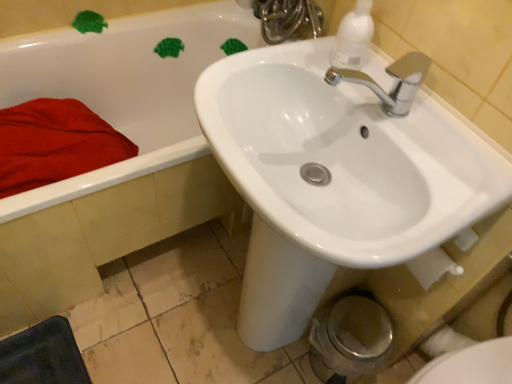
Question: Is white glossy sink at upper center facing away from white glossy faucet at upper center?

Choices:
 (A) yes
 (B) no

Answer: (B)

Question: From the image's perspective, is white glossy sink at upper center beneath white glossy faucet at upper center?

Choices:
 (A) no
 (B) yes

Answer: (B)

Question: From a real-world perspective, is white glossy sink at upper center on white glossy faucet at upper center?

Choices:
 (A) yes
 (B) no

Answer: (B)

Question: Would you say white glossy sink at upper center contains white glossy faucet at upper center?

Choices:
 (A) no
 (B) yes

Answer: (A)

Question: Considering the relative sizes of white glossy sink at upper center and white glossy faucet at upper center in the image provided, is white glossy sink at upper center thinner than white glossy faucet at upper center?

Choices:
 (A) yes
 (B) no

Answer: (B)

Question: In the image, is white glossy bidet at lower right on the left side or the right side of red soft towel at left?

Choices:
 (A) left
 (B) right

Answer: (B)

Question: Relative to red soft towel at left, is white glossy bidet at lower right in front or behind?

Choices:
 (A) behind
 (B) front

Answer: (B)

Question: From the image's perspective, is white glossy bidet at lower right located above or below red soft towel at left?

Choices:
 (A) below
 (B) above

Answer: (A)

Question: Is point (450, 352) closer or farther from the camera than point (90, 150)?

Choices:
 (A) closer
 (B) farther

Answer: (A)

Question: Considering the relative positions of white glossy faucet at upper center and white plastic soap dispenser at upper right in the image provided, is white glossy faucet at upper center to the left or to the right of white plastic soap dispenser at upper right?

Choices:
 (A) left
 (B) right

Answer: (A)

Question: From a real-world perspective, is white glossy faucet at upper center above or below white plastic soap dispenser at upper right?

Choices:
 (A) above
 (B) below

Answer: (B)

Question: Would you say white glossy faucet at upper center is inside or outside white plastic soap dispenser at upper right?

Choices:
 (A) inside
 (B) outside

Answer: (B)

Question: In the image, is white glossy faucet at upper center positioned in front of or behind white plastic soap dispenser at upper right?

Choices:
 (A) front
 (B) behind

Answer: (B)

Question: Is white glossy bidet at lower right spatially inside white glossy faucet at upper center, or outside of it?

Choices:
 (A) outside
 (B) inside

Answer: (A)

Question: Visually, is white glossy bidet at lower right positioned to the left or to the right of white glossy faucet at upper center?

Choices:
 (A) right
 (B) left

Answer: (A)